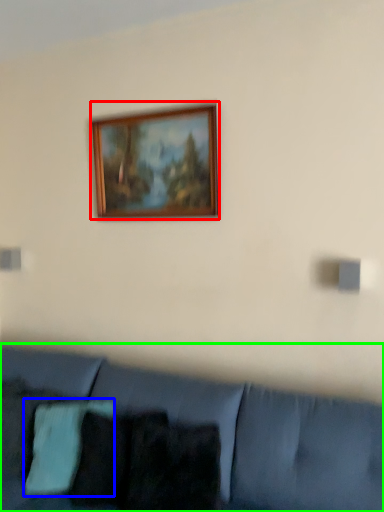
Question: Which is farther away from picture frame (highlighted by a red box)? pillow (highlighted by a blue box) or studio couch (highlighted by a green box)?

Choices:
 (A) pillow
 (B) studio couch

Answer: (A)